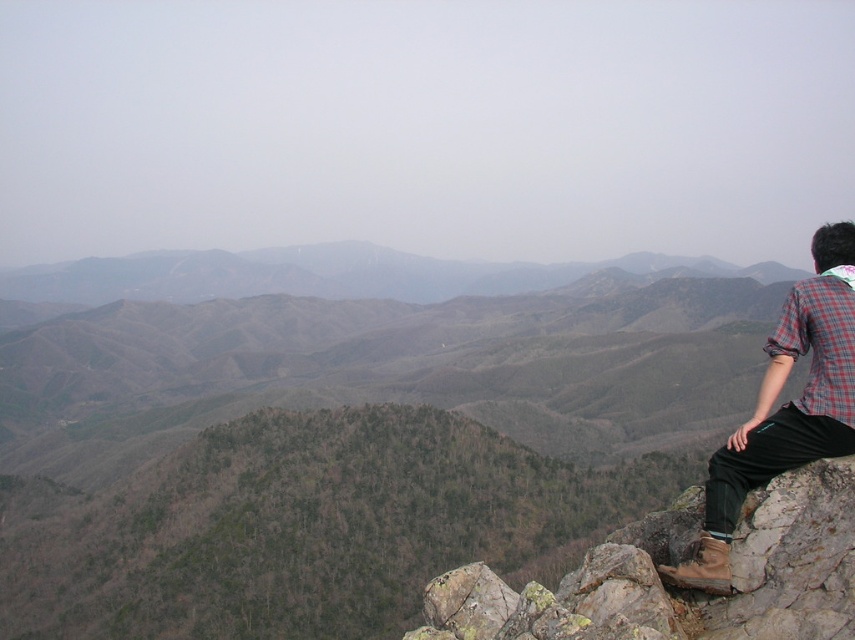
Can you confirm if brown rocky cliff at right is positioned above plaid fabric shirt at right?

Incorrect, brown rocky cliff at right is not positioned above plaid fabric shirt at right.

Does brown rocky cliff at right appear on the right side of plaid fabric shirt at right?

No, brown rocky cliff at right is not to the right of plaid fabric shirt at right.

Is point (805, 536) in front of point (785, 424)?

Yes, it is.

You are a GUI agent. You are given a task and a screenshot of the screen. Output one action in this format:
    pyautogui.click(x=<x>, y=<y>)
    Task: Click on the brown rocky cliff at right
    
    Given the screenshot: What is the action you would take?
    pyautogui.click(x=677, y=589)